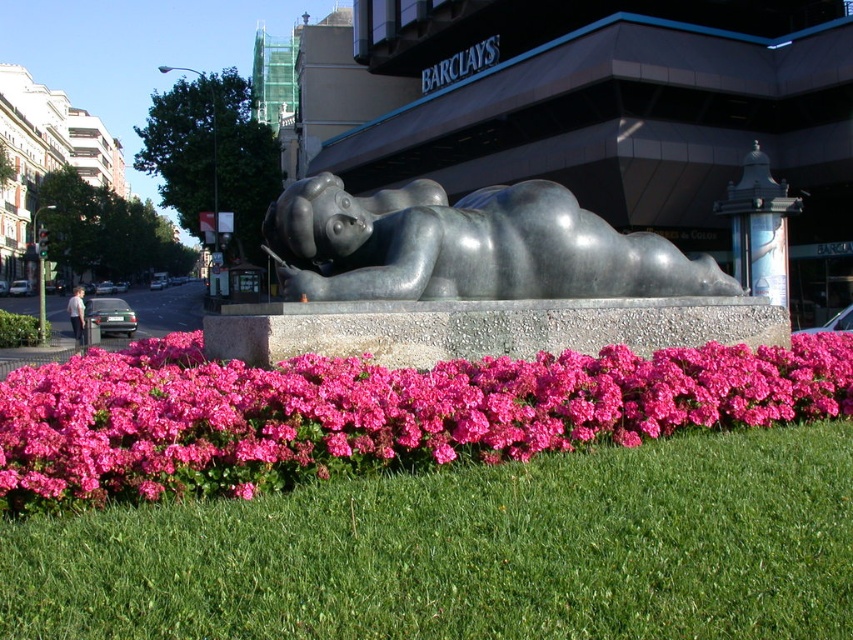
Is pink matte flowers at center below polished gray statue at center?

Yes, pink matte flowers at center is below polished gray statue at center.

Does point (94, 506) lie behind point (520, 220)?

No.

The height and width of the screenshot is (640, 853). In order to click on pink matte flowers at center in this screenshot , I will do `click(370, 413)`.

Locate an element on the screen. pink matte flowers at center is located at coordinates (370, 413).

Consider the image. Does green grass at lower center have a lesser width compared to pink matte flowers at center?

Yes.

Is point (149, 545) positioned behind point (502, 385)?

No, (149, 545) is in front of (502, 385).

Who is more distant from viewer, (467,595) or (546,396)?

The point (546,396) is behind.

In order to click on green grass at lower center in this screenshot , I will do `click(469, 552)`.

Consider the image. Between green grass at lower center and polished gray statue at center, which one appears on the left side from the viewer's perspective?

Positioned to the left is green grass at lower center.

Between point (666, 486) and point (379, 209), which one is positioned behind?

The point (379, 209) is behind.

Identify the location of green grass at lower center. Image resolution: width=853 pixels, height=640 pixels. (469, 552).